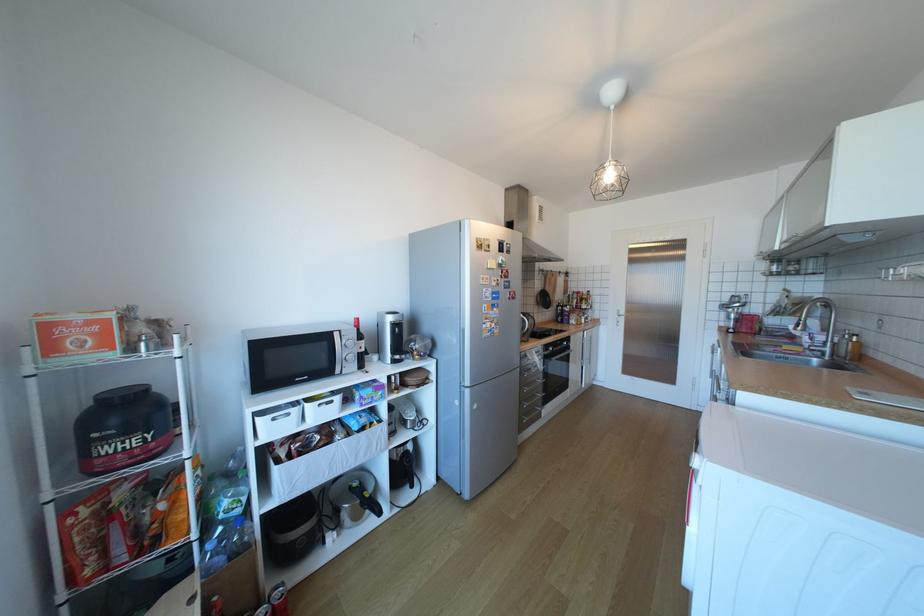
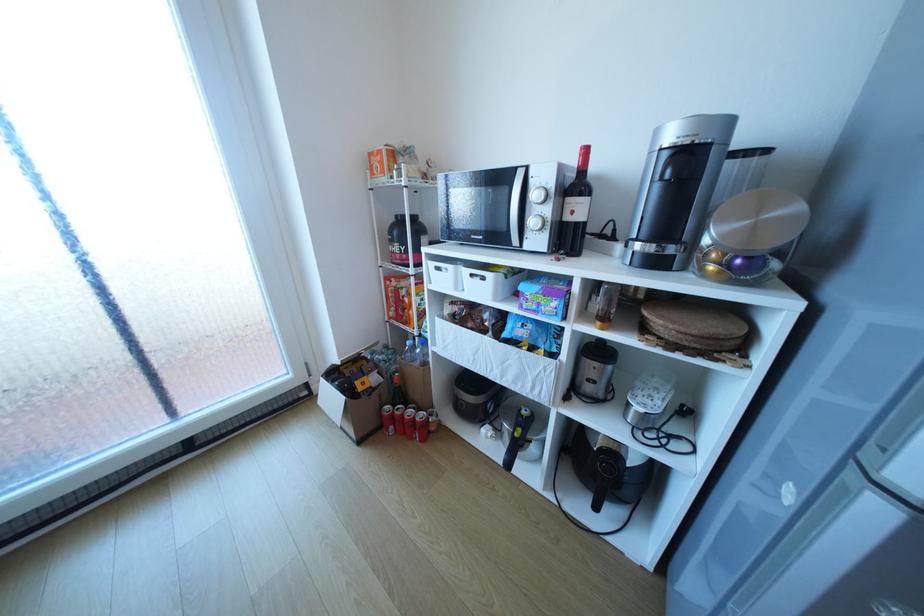
Where in the second image is the point corresponding to (283,419) from the first image?

(446, 268)